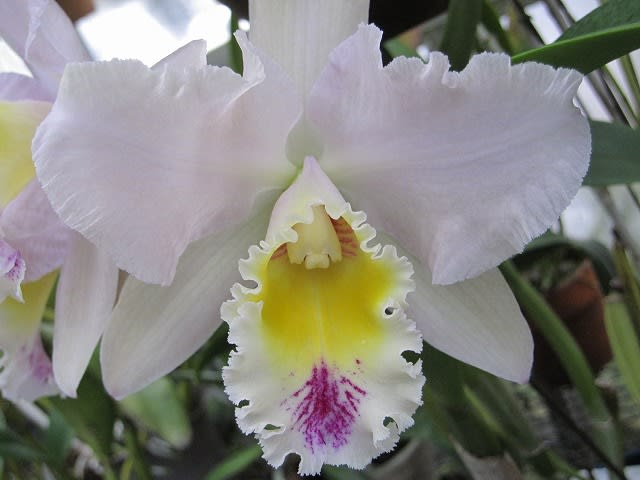
This screenshot has height=480, width=640. Find the location of `floor`. floor is located at coordinates pos(589,224).